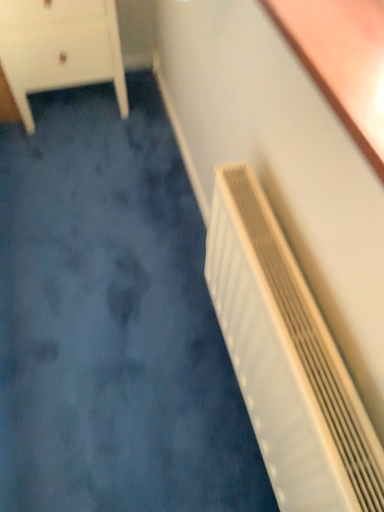
Question: From their relative heights in the image, would you say white matte chest of drawers at upper left is taller or shorter than white plastic radiator at right?

Choices:
 (A) short
 (B) tall

Answer: (A)

Question: Is white matte chest of drawers at upper left to the left or to the right of white plastic radiator at right in the image?

Choices:
 (A) left
 (B) right

Answer: (A)

Question: Is point (82, 53) positioned closer to the camera than point (215, 227)?

Choices:
 (A) closer
 (B) farther

Answer: (B)

Question: Is white plastic radiator at right in front of or behind white matte chest of drawers at upper left in the image?

Choices:
 (A) behind
 (B) front

Answer: (B)

Question: Is point (377, 478) positioned closer to the camera than point (66, 45)?

Choices:
 (A) farther
 (B) closer

Answer: (B)

Question: Would you say white plastic radiator at right is to the left or to the right of white matte chest of drawers at upper left in the picture?

Choices:
 (A) left
 (B) right

Answer: (B)

Question: Looking at their shapes, would you say white plastic radiator at right is wider or thinner than white matte chest of drawers at upper left?

Choices:
 (A) thin
 (B) wide

Answer: (A)